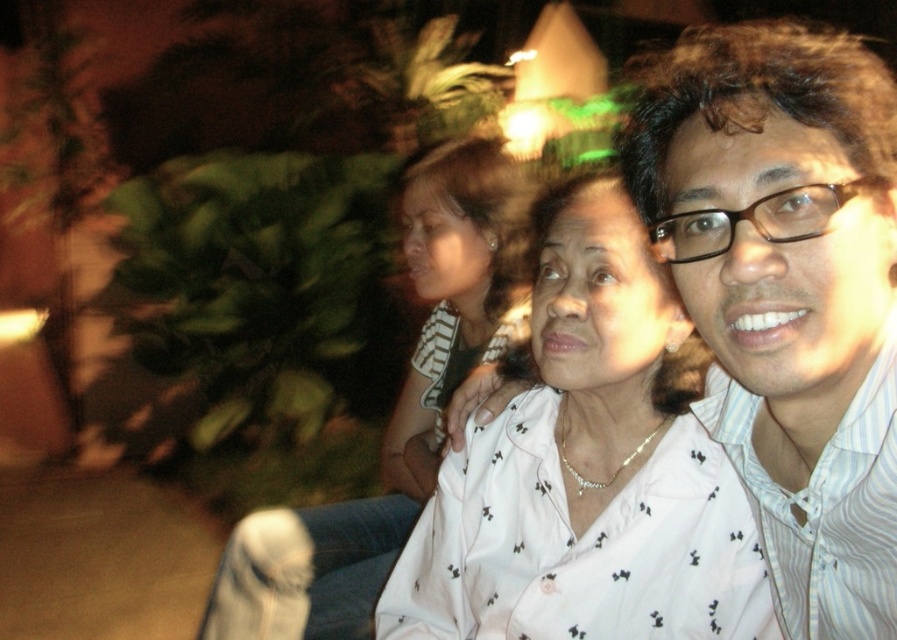
Question: Among these points, which one is farthest from the camera?

Choices:
 (A) (804, 586)
 (B) (874, 481)
 (C) (405, 195)

Answer: (C)

Question: Does white striped shirt at center have a larger size compared to white printed shirt at center?

Choices:
 (A) no
 (B) yes

Answer: (A)

Question: Based on their relative distances, which object is nearer to the white printed blouse at center?

Choices:
 (A) white striped shirt at center
 (B) white printed shirt at center
 (C) white striped shirt at right

Answer: (C)

Question: Does white striped shirt at center have a greater width compared to white printed shirt at center?

Choices:
 (A) yes
 (B) no

Answer: (B)

Question: Considering the relative positions of white printed blouse at center and white striped shirt at right in the image provided, where is white printed blouse at center located with respect to white striped shirt at right?

Choices:
 (A) right
 (B) left

Answer: (B)

Question: Considering the real-world distances, which object is farthest from the white striped shirt at center?

Choices:
 (A) white printed blouse at center
 (B) white striped shirt at right

Answer: (A)